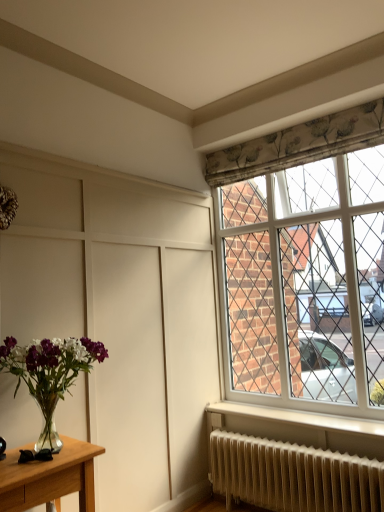
Question: Is clear glass vase at lower left in contact with white textured radiator at lower right?

Choices:
 (A) no
 (B) yes

Answer: (A)

Question: Can you confirm if clear glass vase at lower left is wider than white textured radiator at lower right?

Choices:
 (A) no
 (B) yes

Answer: (B)

Question: Is clear glass vase at lower left positioned before white textured radiator at lower right?

Choices:
 (A) no
 (B) yes

Answer: (B)

Question: Is clear glass vase at lower left aimed at white textured radiator at lower right?

Choices:
 (A) no
 (B) yes

Answer: (A)

Question: Is clear glass vase at lower left positioned with its back to white textured radiator at lower right?

Choices:
 (A) yes
 (B) no

Answer: (B)

Question: Is white textured radiator at lower right in front of or behind clear glass vase at lower left in the image?

Choices:
 (A) behind
 (B) front

Answer: (A)

Question: From the image's perspective, is white textured radiator at lower right positioned above or below clear glass vase at lower left?

Choices:
 (A) above
 (B) below

Answer: (B)

Question: Is white textured radiator at lower right taller or shorter than clear glass vase at lower left?

Choices:
 (A) short
 (B) tall

Answer: (A)

Question: Is white textured radiator at lower right situated inside clear glass vase at lower left or outside?

Choices:
 (A) inside
 (B) outside

Answer: (B)

Question: From a real-world perspective, is white plastic window at upper right positioned above or below white textured radiator at lower right?

Choices:
 (A) above
 (B) below

Answer: (A)

Question: In terms of width, does white plastic window at upper right look wider or thinner when compared to white textured radiator at lower right?

Choices:
 (A) wide
 (B) thin

Answer: (B)

Question: Is white plastic window at upper right in front of or behind white textured radiator at lower right in the image?

Choices:
 (A) front
 (B) behind

Answer: (B)

Question: Is white plastic window at upper right spatially inside white textured radiator at lower right, or outside of it?

Choices:
 (A) outside
 (B) inside

Answer: (A)

Question: From the image's perspective, is clear glass vase at lower left above or below white textured radiator at lower right?

Choices:
 (A) above
 (B) below

Answer: (A)

Question: Is clear glass vase at lower left taller or shorter than white textured radiator at lower right?

Choices:
 (A) tall
 (B) short

Answer: (A)